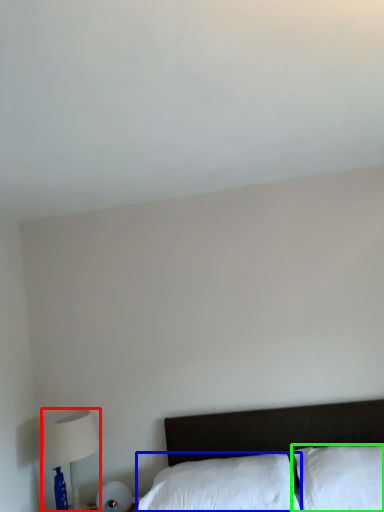
Question: Which is nearer to the table lamp (highlighted by a red box)? pillow (highlighted by a blue box) or pillow (highlighted by a green box).

Choices:
 (A) pillow
 (B) pillow

Answer: (A)